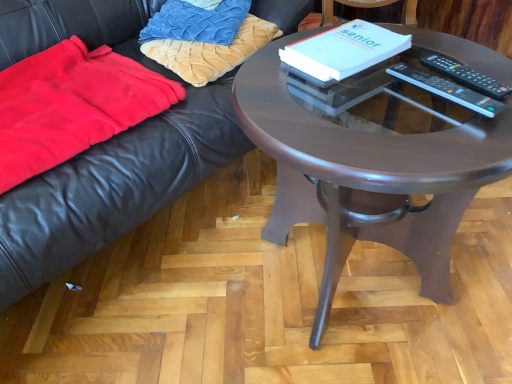
Identify the location of vacant area located to the right-hand side of white paper at center. (440, 56).